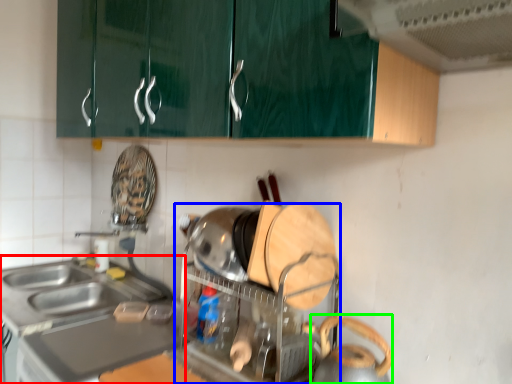
Question: Estimate the real-world distances between objects in this image. Which object is closer to countertop (highlighted by a red box), appliance (highlighted by a blue box) or appliance (highlighted by a green box)?

Choices:
 (A) appliance
 (B) appliance

Answer: (A)